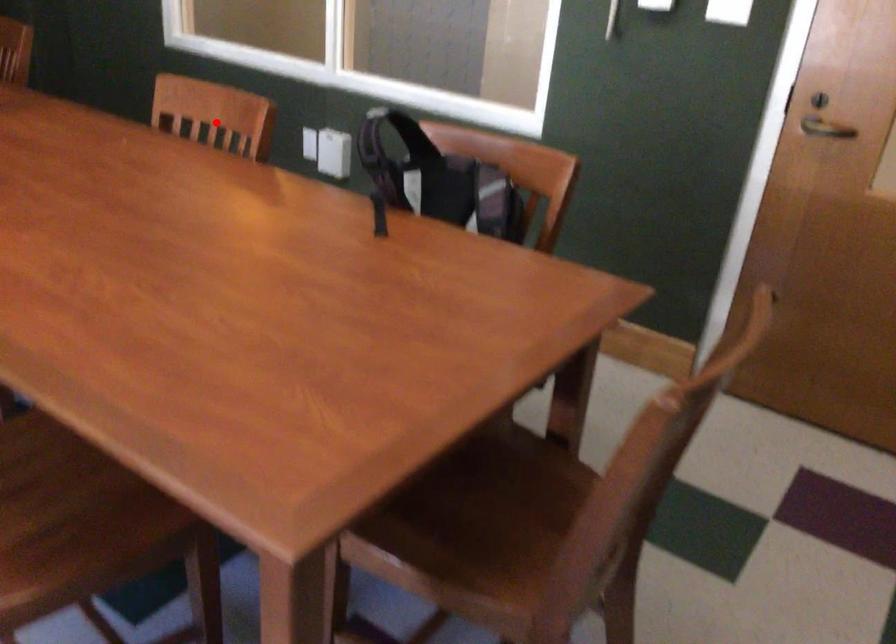
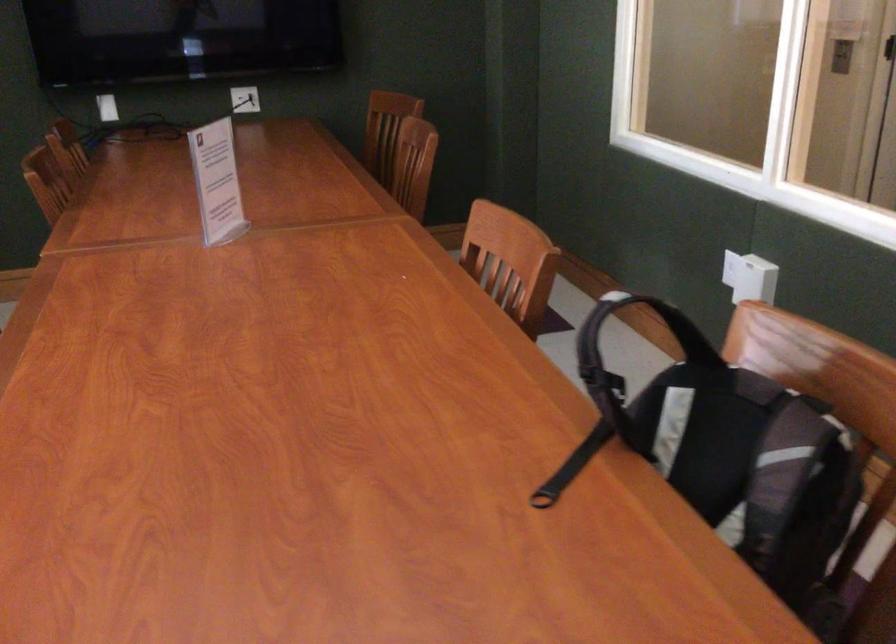
In the second image, find the point that corresponds to the highlighted location in the first image.

(510, 261)